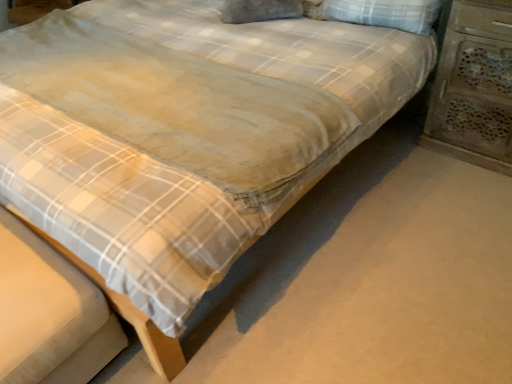
Describe the element at coordinates (378, 13) in the screenshot. I see `white checkered pillow at upper right` at that location.

Identify the location of white checkered pillow at upper right. (378, 13).

In order to click on wooden carved nightstand at right in this screenshot , I will do `click(474, 86)`.

Describe the element at coordinates (474, 86) in the screenshot. This screenshot has height=384, width=512. I see `wooden carved nightstand at right` at that location.

The width and height of the screenshot is (512, 384). Find the location of `white checkered pillow at upper right`. white checkered pillow at upper right is located at coordinates (378, 13).

Which object is positioned more to the left, white checkered pillow at upper right or wooden carved nightstand at right?

white checkered pillow at upper right is more to the left.

Is white checkered pillow at upper right further to the viewer compared to wooden carved nightstand at right?

Yes.

Is point (345, 0) positioned before point (457, 33)?

No, it is not.

From the image's perspective, is white checkered pillow at upper right below wooden carved nightstand at right?

No.

From a real-world perspective, relative to wooden carved nightstand at right, is white checkered pillow at upper right vertically above or below?

From a real-world perspective, white checkered pillow at upper right is physically above wooden carved nightstand at right.

Is white checkered pillow at upper right wider than wooden carved nightstand at right?

In fact, white checkered pillow at upper right might be narrower than wooden carved nightstand at right.

Considering the sizes of objects white checkered pillow at upper right and wooden carved nightstand at right in the image provided, who is shorter, white checkered pillow at upper right or wooden carved nightstand at right?

Standing shorter between the two is white checkered pillow at upper right.

Is white checkered pillow at upper right bigger or smaller than wooden carved nightstand at right?

In the image, white checkered pillow at upper right appears to be smaller than wooden carved nightstand at right.

Is white checkered pillow at upper right not within wooden carved nightstand at right?

That's correct, white checkered pillow at upper right is outside of wooden carved nightstand at right.

Is white checkered pillow at upper right far from wooden carved nightstand at right?

Actually, white checkered pillow at upper right and wooden carved nightstand at right are a little close together.

Is white checkered pillow at upper right looking in the opposite direction of wooden carved nightstand at right?

That's not correct — white checkered pillow at upper right is not looking away from wooden carved nightstand at right.

Where is `pillow behind the wooden carved nightstand at right`? The width and height of the screenshot is (512, 384). pillow behind the wooden carved nightstand at right is located at coordinates (378, 13).

Considering the positions of objects wooden carved nightstand at right and white checkered pillow at upper right in the image provided, who is more to the left, wooden carved nightstand at right or white checkered pillow at upper right?

white checkered pillow at upper right is more to the left.

In the image, is wooden carved nightstand at right positioned in front of or behind white checkered pillow at upper right?

Clearly, wooden carved nightstand at right is in front of white checkered pillow at upper right.

Based on the photo, which point is more distant from viewer, [507,143] or [333,13]?

The point [333,13] is farther.

Consider the image. From the image's perspective, is wooden carved nightstand at right located beneath white checkered pillow at upper right?

Indeed, from the image's perspective, wooden carved nightstand at right is shown beneath white checkered pillow at upper right.

From a real-world perspective, which object stands above the other?

In real-world perspective, white checkered pillow at upper right is above.

Considering the relative sizes of wooden carved nightstand at right and white checkered pillow at upper right in the image provided, is wooden carved nightstand at right wider than white checkered pillow at upper right?

Yes.

Can you confirm if wooden carved nightstand at right is taller than white checkered pillow at upper right?

Indeed, wooden carved nightstand at right has a greater height compared to white checkered pillow at upper right.

Is wooden carved nightstand at right bigger than white checkered pillow at upper right?

Indeed, wooden carved nightstand at right has a larger size compared to white checkered pillow at upper right.

Would you say wooden carved nightstand at right is inside or outside white checkered pillow at upper right?

wooden carved nightstand at right is located beyond the bounds of white checkered pillow at upper right.

Is wooden carved nightstand at right next to white checkered pillow at upper right and touching it?

wooden carved nightstand at right is not next to white checkered pillow at upper right, and they're not touching.

Could you tell me if wooden carved nightstand at right is facing white checkered pillow at upper right?

No.

You are a GUI agent. You are given a task and a screenshot of the screen. Output one action in this format:
    pyautogui.click(x=<x>, y=<y>)
    Task: Click on the nightstand below the white checkered pillow at upper right (from a real-world perspective)
    
    Given the screenshot: What is the action you would take?
    474,86

At what (x,y) coordinates should I click in order to perform the action: click on pillow on the left of wooden carved nightstand at right. Please return your answer as a coordinate pair (x, y). The height and width of the screenshot is (384, 512). Looking at the image, I should click on (378, 13).

Find the location of `pillow above the wooden carved nightstand at right (from the image's perspective)`. pillow above the wooden carved nightstand at right (from the image's perspective) is located at coordinates (378, 13).